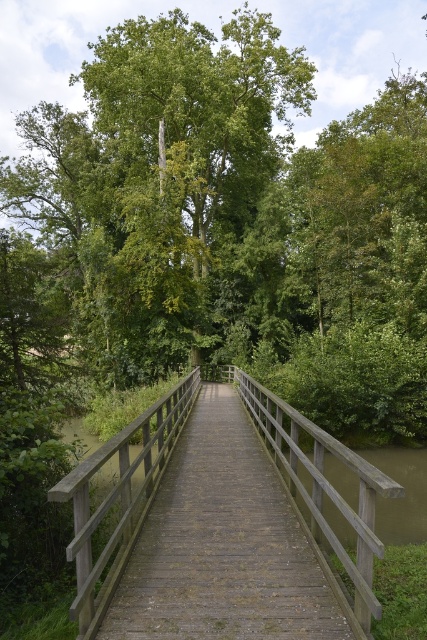
Question: Is the position of green leafy tree at center more distant than that of wooden bridge at center?

Choices:
 (A) yes
 (B) no

Answer: (A)

Question: Is green leafy tree at center positioned behind wooden bridge at center?

Choices:
 (A) yes
 (B) no

Answer: (A)

Question: Which of the following is the farthest from the observer?

Choices:
 (A) (187, 198)
 (B) (128, 497)

Answer: (A)

Question: Which object is farther from the camera taking this photo?

Choices:
 (A) wooden bridge at center
 (B) green leafy tree at center

Answer: (B)

Question: Is green leafy tree at center closer to the viewer compared to wooden bridge at center?

Choices:
 (A) no
 (B) yes

Answer: (A)